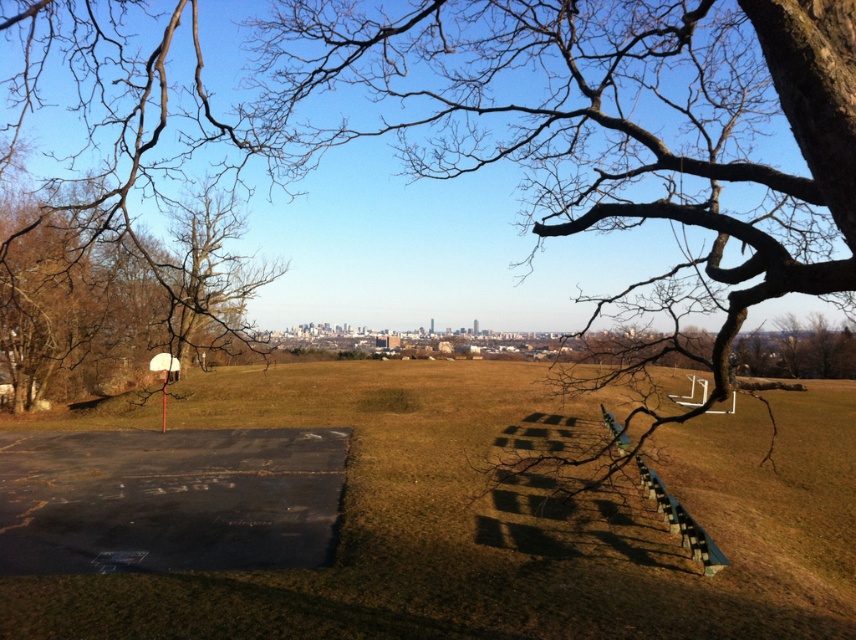
What do you see at coordinates (504, 518) in the screenshot?
I see `green grass at center` at bounding box center [504, 518].

Does green grass at center have a smaller size compared to white matte basketball hoop at center-left?

No.

Between point (544, 621) and point (156, 356), which one is positioned behind?

The point (156, 356) is more distant.

This screenshot has width=856, height=640. I want to click on green grass at center, so click(504, 518).

Is green grass at center closer to the viewer compared to brown bark tree at left?

No, it is not.

Measure the distance between green grass at center and brown bark tree at left.

green grass at center is 8.87 meters from brown bark tree at left.

Identify the location of green grass at center. This screenshot has width=856, height=640. [x=504, y=518].

How much distance is there between brown bark tree at left and white matte basketball hoop at center-left?

They are 8.20 meters apart.

Does brown bark tree at left have a lesser height compared to white matte basketball hoop at center-left?

In fact, brown bark tree at left may be taller than white matte basketball hoop at center-left.

This screenshot has height=640, width=856. Find the location of `brown bark tree at left`. brown bark tree at left is located at coordinates (114, 291).

I want to click on brown bark tree at left, so click(x=114, y=291).